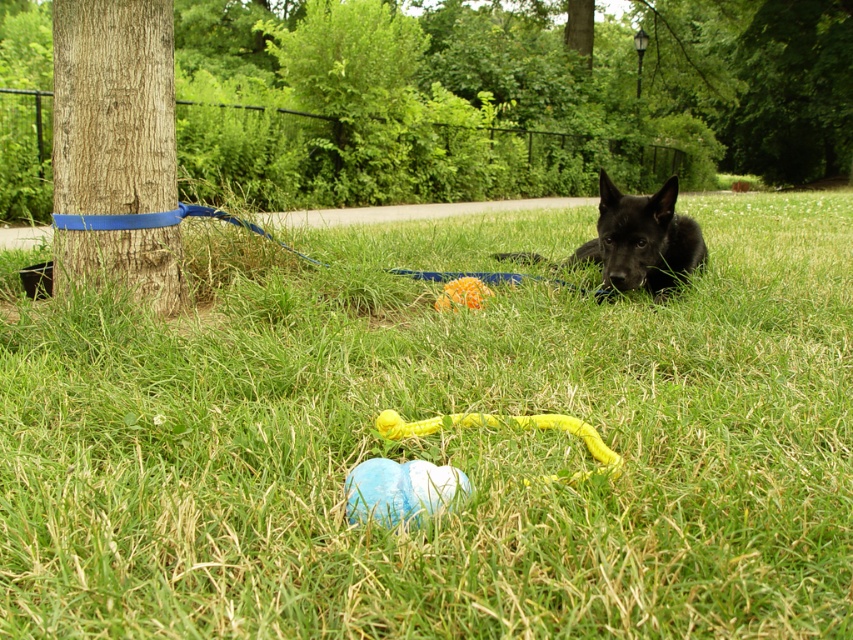
Question: Is black glossy dog at center positioned at the back of blue rubber balls at center?

Choices:
 (A) no
 (B) yes

Answer: (B)

Question: Which of these objects is positioned closest to the brown rough bark at left?

Choices:
 (A) black glossy dog at center
 (B) yellow rubber leash at lower center
 (C) green grass at lower center
 (D) blue rubber leash at left

Answer: (D)

Question: Does brown rough bark at left have a smaller size compared to blue rubber leash at left?

Choices:
 (A) yes
 (B) no

Answer: (B)

Question: Is black glossy dog at center smaller than blue rubber leash at left?

Choices:
 (A) yes
 (B) no

Answer: (B)

Question: Which of these objects is positioned closest to the yellow rubber leash at lower center?

Choices:
 (A) brown rough bark at left
 (B) blue rubber balls at center

Answer: (B)

Question: Which object is the farthest from the blue rubber leash at left?

Choices:
 (A) yellow rubber leash at lower center
 (B) orange rubber ball at center
 (C) black glossy dog at center

Answer: (A)